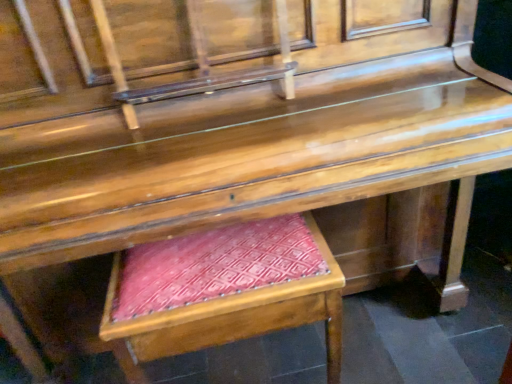
Locate an element on the screen. This screenshot has width=512, height=384. empty space that is ontop of red leather stool at center (from a real-world perspective) is located at coordinates (222, 258).